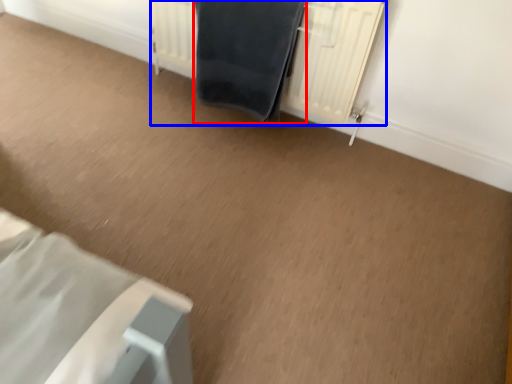
Question: Which object appears closest to the camera in this image, bath towel (highlighted by a red box) or radiator (highlighted by a blue box)?

Choices:
 (A) bath towel
 (B) radiator

Answer: (B)